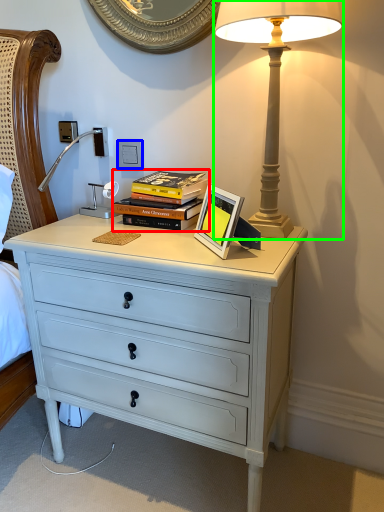
Question: Which object is positioned farthest from book (highlighted by a red box)? Select from electric outlet (highlighted by a blue box) and lamp (highlighted by a green box).

Choices:
 (A) electric outlet
 (B) lamp

Answer: (B)